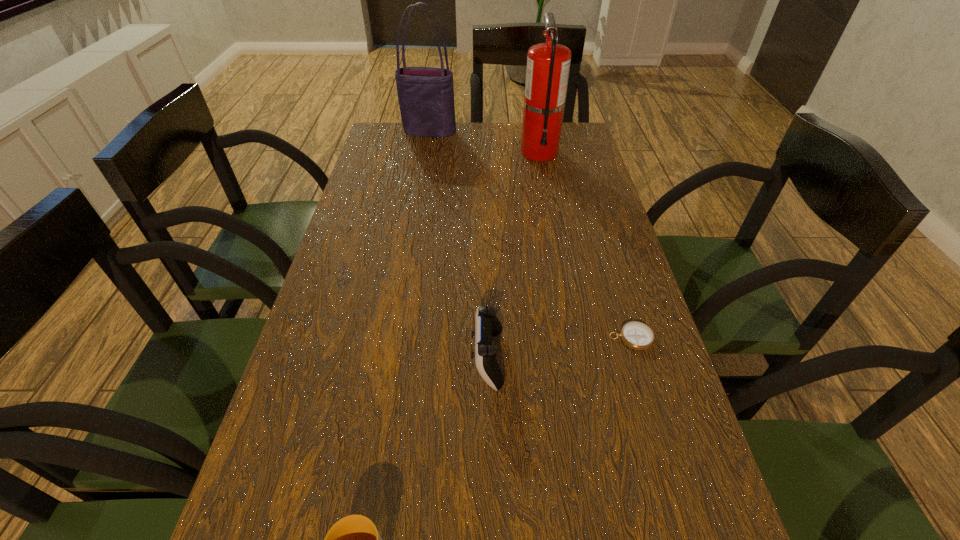
The image size is (960, 540). In the image, there is a desktop. Find the location of `free region at the right edge`. free region at the right edge is located at coordinates (605, 323).

Identify the location of blank space at the far left corner of the desktop. (385, 142).

Image resolution: width=960 pixels, height=540 pixels. I want to click on vacant area that lies between the fire extinguisher and the farthest object, so click(484, 142).

Locate an element on the screen. This screenshot has width=960, height=540. free space between the shortest object and the farthest object is located at coordinates (530, 235).

Identify the location of free area in between the compass and the tote bag. [530, 235].

Identify the location of free space between the control and the rightmost object. (559, 348).

Locate an element on the screen. The width and height of the screenshot is (960, 540). vacant region between the compass and the tote bag is located at coordinates (530, 235).

Locate an element on the screen. The width and height of the screenshot is (960, 540). unoccupied area between the fire extinguisher and the shortest object is located at coordinates (x=585, y=245).

Where is `free space between the fourth nearest object and the rightmost object`? free space between the fourth nearest object and the rightmost object is located at coordinates (585, 245).

Find the location of a particular element. This screenshot has width=960, height=540. object that stands as the closest to the compass is located at coordinates (487, 325).